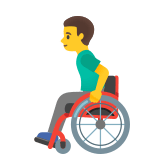
Locate an element on the screen. The image size is (160, 160). red wheel chair is located at coordinates (117, 95).